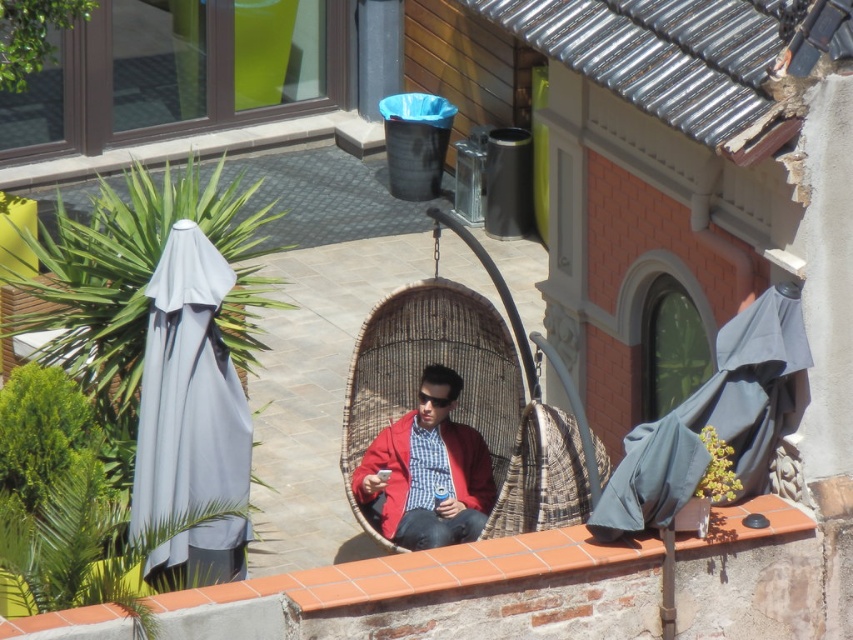
You are planning to set up a small table between the gray fabric umbrella at left and the dark gray fabric umbrella at right. Which umbrella should you place the table closer to if you want the table to be near the smaller one?

You should place the table closer to the gray fabric umbrella at left because it is smaller than the dark gray fabric umbrella at right.

You are standing at the entrance of the patio and want to place a new potted plant exactly where the dark gray fabric umbrella at right is currently positioned. Is this possible without moving the umbrella?

The dark gray fabric umbrella at right is located at point (711, 420), so placing the potted plant at that exact coordinate would require moving the umbrella first.

You are a guest at this outdoor seating area and want to place a small potted plant on the terracotta brick ledge at lower center. However, you notice the woven rattan chair at center is in the way. Can you place the plant on the ledge without moving the chair?

The terracotta brick ledge at lower center is below the woven rattan chair at center, so you can place the plant on the ledge without moving the chair because the chair is positioned above it.